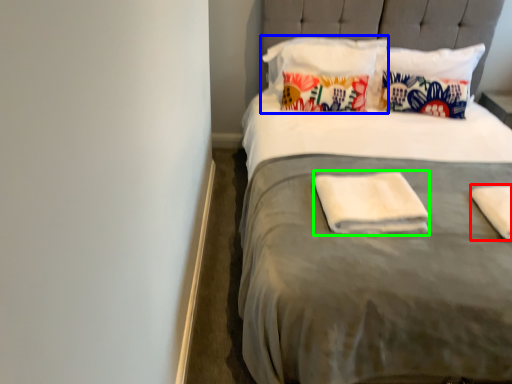
Question: Which object is positioned closest to material (highlighted by a red box)? Select from pillow (highlighted by a blue box) and material (highlighted by a green box).

Choices:
 (A) pillow
 (B) material

Answer: (B)